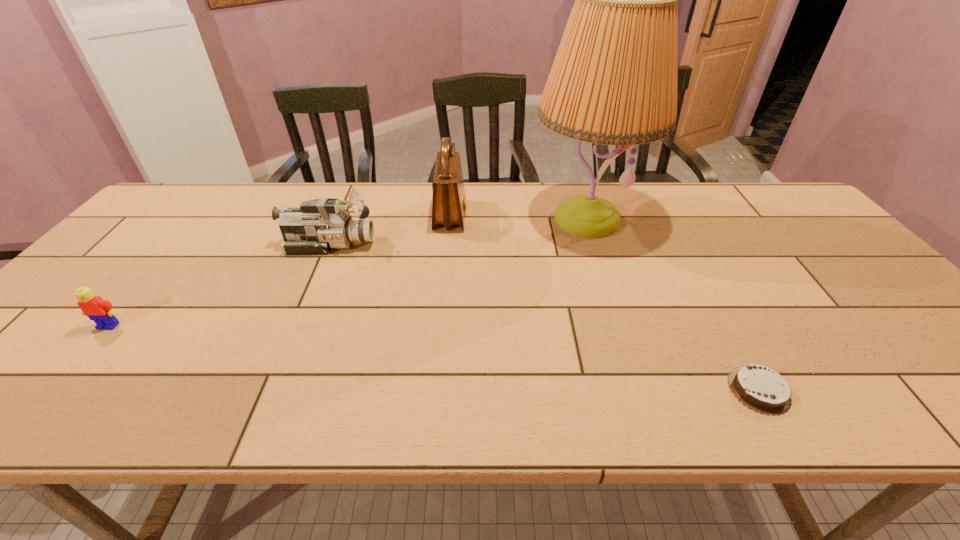
Find the location of a particular element. The height and width of the screenshot is (540, 960). vacant space at the right edge of the desktop is located at coordinates (911, 357).

This screenshot has width=960, height=540. I want to click on vacant space at the far left corner, so click(157, 210).

Identify the location of free space between the camcorder and the shortest object. This screenshot has height=540, width=960. (544, 317).

The width and height of the screenshot is (960, 540). In order to click on empty space that is in between the nearest object and the second object from left to right in this screenshot , I will do `click(544, 317)`.

You are a GUI agent. You are given a task and a screenshot of the screen. Output one action in this format:
    pyautogui.click(x=<x>, y=<y>)
    Task: Click on the unoccupied area between the third object from right to left and the fourth object from right to left
    The height and width of the screenshot is (540, 960).
    Given the screenshot: What is the action you would take?
    pyautogui.click(x=390, y=230)

The width and height of the screenshot is (960, 540). I want to click on empty location between the second shortest object and the third object from left to right, so pyautogui.click(x=279, y=271).

The image size is (960, 540). Identify the location of free space between the Lego and the tallest object. (348, 272).

Where is `vacant space in between the fourth object from right to left and the Lego`? vacant space in between the fourth object from right to left and the Lego is located at coordinates click(219, 285).

This screenshot has height=540, width=960. I want to click on vacant area between the fourth shortest object and the third shortest object, so click(x=390, y=230).

Where is `unoccupied position between the shortest object and the third shortest object`? The width and height of the screenshot is (960, 540). unoccupied position between the shortest object and the third shortest object is located at coordinates (544, 317).